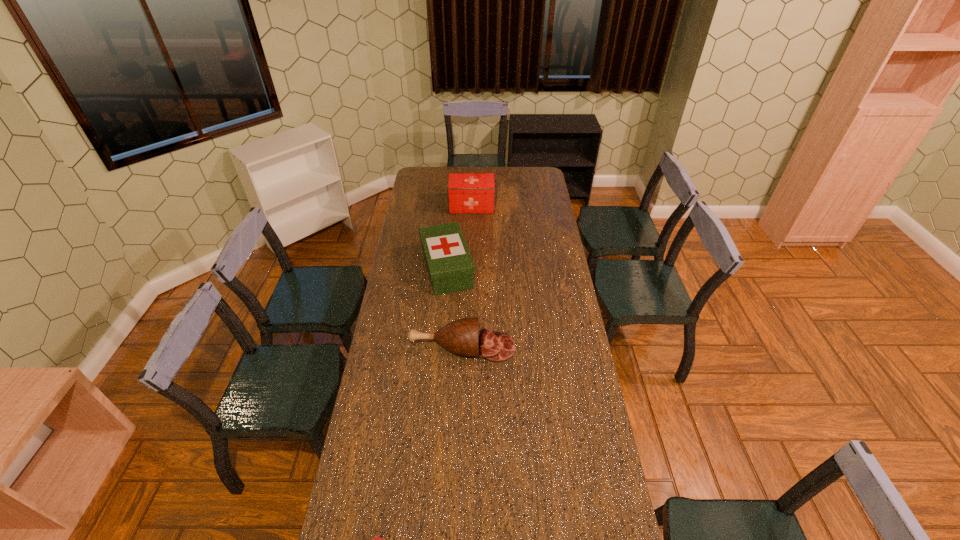
Locate an element on the screen. The height and width of the screenshot is (540, 960). the first-aid kit that stands as the second closest to the second shortest first-aid kit is located at coordinates (376, 539).

Where is `the second closest first-aid kit to the third nearest object`? the second closest first-aid kit to the third nearest object is located at coordinates (376, 539).